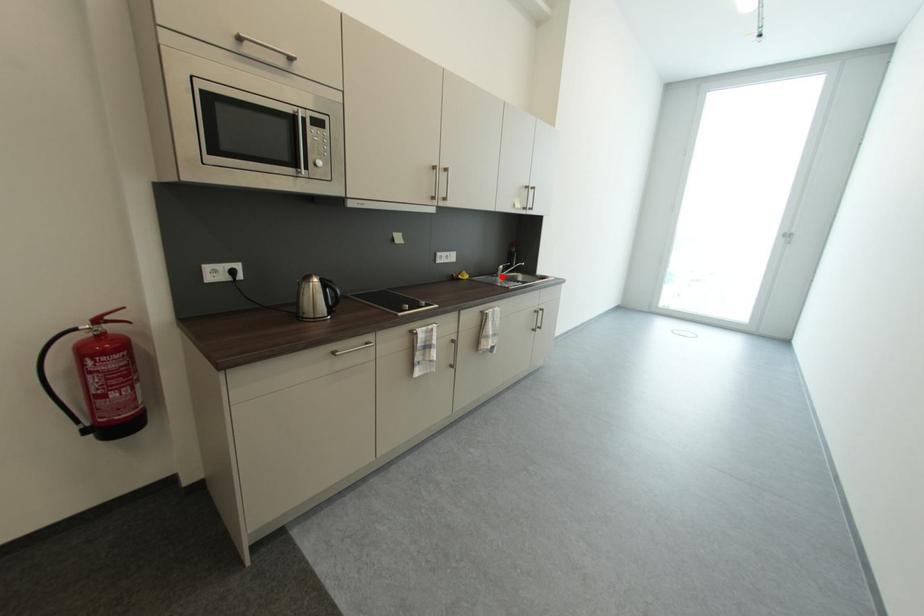
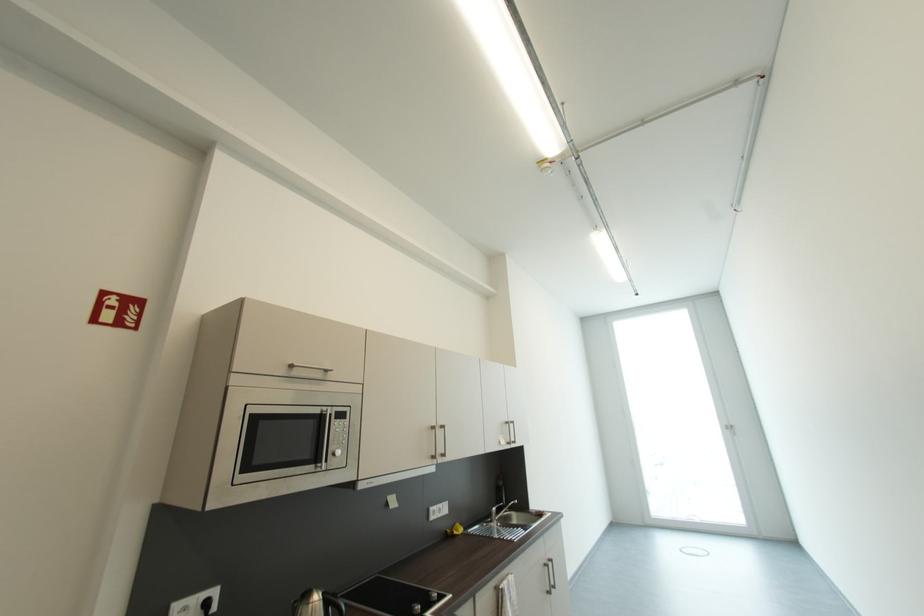
Question: A red point is marked in image1. In image2, is the corresponding 3D point closer to the camera or farther? Reply with the corresponding letter.

Choices:
 (A) The corresponding 3D point is closer.
 (B) The corresponding 3D point is farther.

Answer: (B)